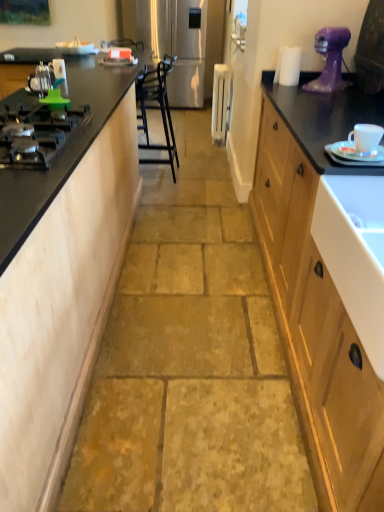
You are a GUI agent. You are given a task and a screenshot of the screen. Output one action in this format:
    pyautogui.click(x=<x>, y=<y>)
    Task: Click on the vacant space to the right of metallic silver kettle at left, which ranks as the fourth appliance in right-to-left order
    Image resolution: width=384 pixels, height=512 pixels.
    Given the screenshot: What is the action you would take?
    pyautogui.click(x=77, y=97)